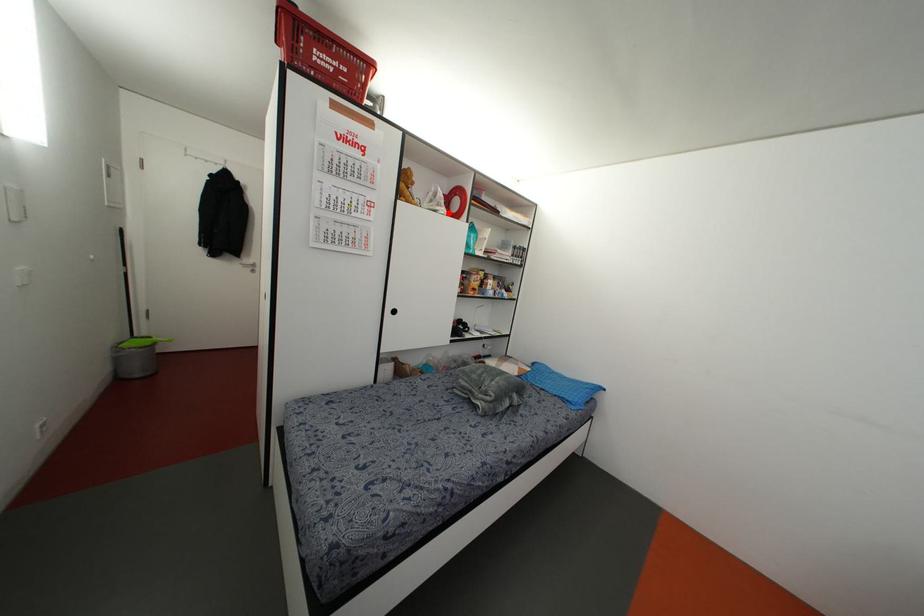
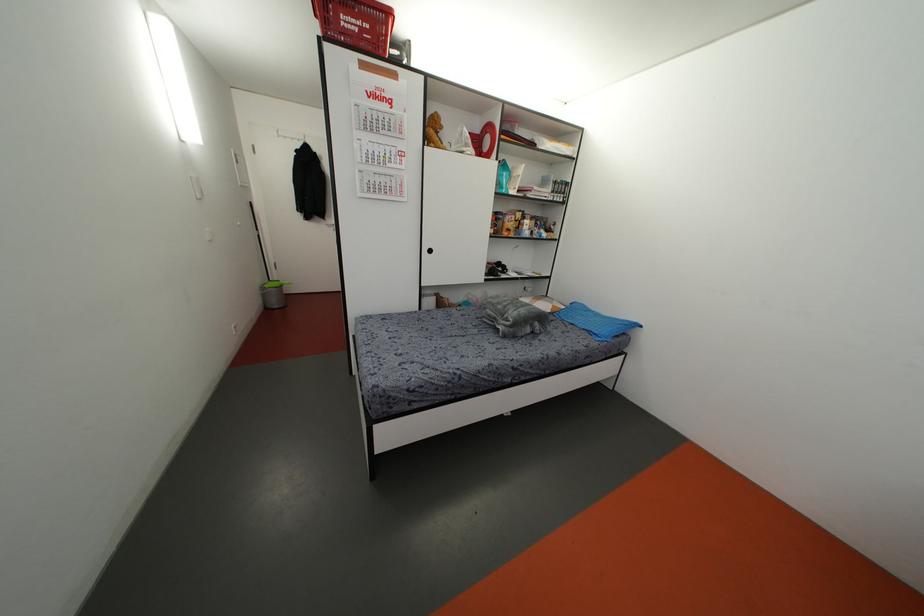
Question: I am providing you with two images of the same scene from different viewpoints. Image1 has a red point marked. In image2, the corresponding 3D location appears at what relative position? Reply with the corresponding letter.

Choices:
 (A) Closer
 (B) Farther

Answer: (A)